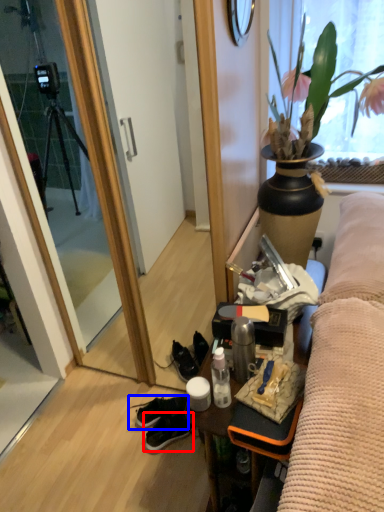
Question: Which object is further to the camera taking this photo, sneakers (highlighted by a red box) or footwear (highlighted by a blue box)?

Choices:
 (A) sneakers
 (B) footwear

Answer: (B)